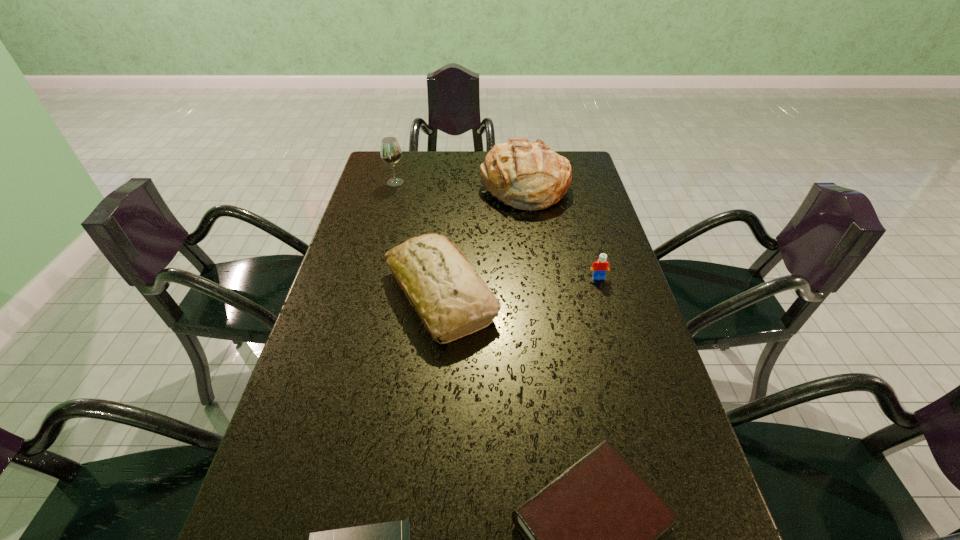
In order to click on wineglass positioned at the far edge in this screenshot , I will do `click(390, 151)`.

Find the location of a particular element. This screenshot has width=960, height=540. wineglass that is at the left edge is located at coordinates (390, 151).

You are a GUI agent. You are given a task and a screenshot of the screen. Output one action in this format:
    pyautogui.click(x=<x>, y=<y>)
    Task: Click on the bread that is positioned at the left edge
    
    Given the screenshot: What is the action you would take?
    pyautogui.click(x=451, y=300)

This screenshot has height=540, width=960. Identify the location of bread that is at the right edge. (529, 176).

Locate an element on the screen. The height and width of the screenshot is (540, 960). Lego situated at the right edge is located at coordinates (601, 266).

In order to click on object located at the far left corner in this screenshot , I will do `click(390, 151)`.

Image resolution: width=960 pixels, height=540 pixels. I want to click on object present at the far right corner, so click(529, 176).

Where is `vacant area at the far edge`? vacant area at the far edge is located at coordinates (456, 174).

Image resolution: width=960 pixels, height=540 pixels. In order to click on vacant space at the left edge of the desktop in this screenshot , I will do `click(374, 222)`.

Where is `vacant position at the right edge of the desktop`? The width and height of the screenshot is (960, 540). vacant position at the right edge of the desktop is located at coordinates (578, 209).